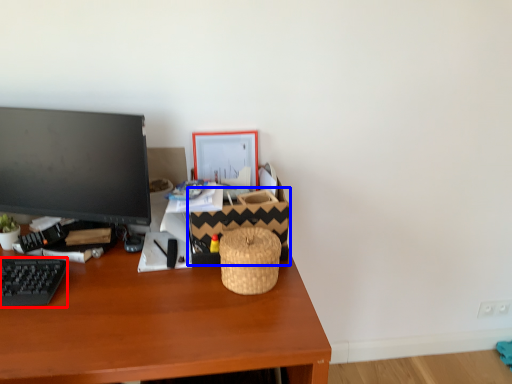
Question: Among these objects, which one is farthest to the camera, computer keyboard (highlighted by a red box) or basket (highlighted by a blue box)?

Choices:
 (A) computer keyboard
 (B) basket

Answer: (B)